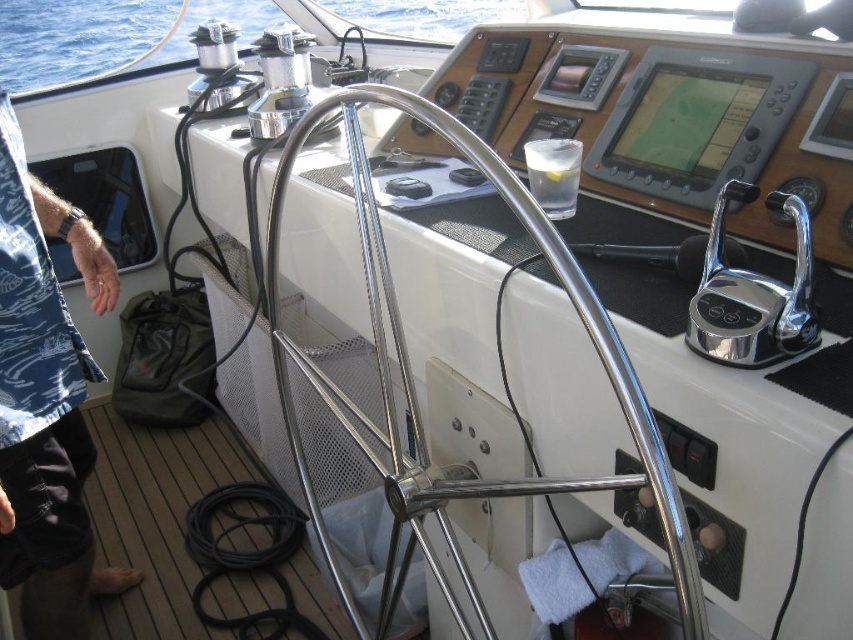
You are a sailor standing in the cockpit of the sailboat. You need to reach the blue printed fabric at left to adjust its position. Can you comfortably reach it while standing in your current position?

The blue printed fabric at left is 36.03 inches away from the viewer, so yes, it can be comfortably reached while standing in the current position.

You are inside the sailboat cockpit and need to locate a specific point for a navigation task. The point is labeled as point (45,403). According to the scene description, where exactly is this point located?

The point (45,403) is located on the blue printed fabric at left.

You are a sailor trying to navigate using the coordinates of two points in the cockpit. The points are labeled as point (39, 342) and point (67, 19). Which point is closer to your current position when standing in front of the steering wheel?

Point (39, 342) is closer to the camera than point (67, 19), so the point closer to your current position is point (39, 342).